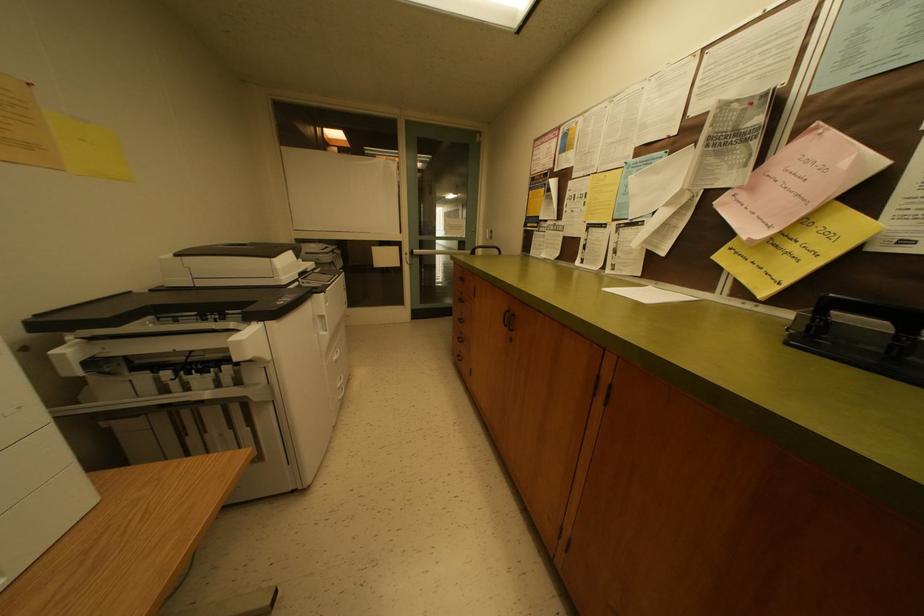
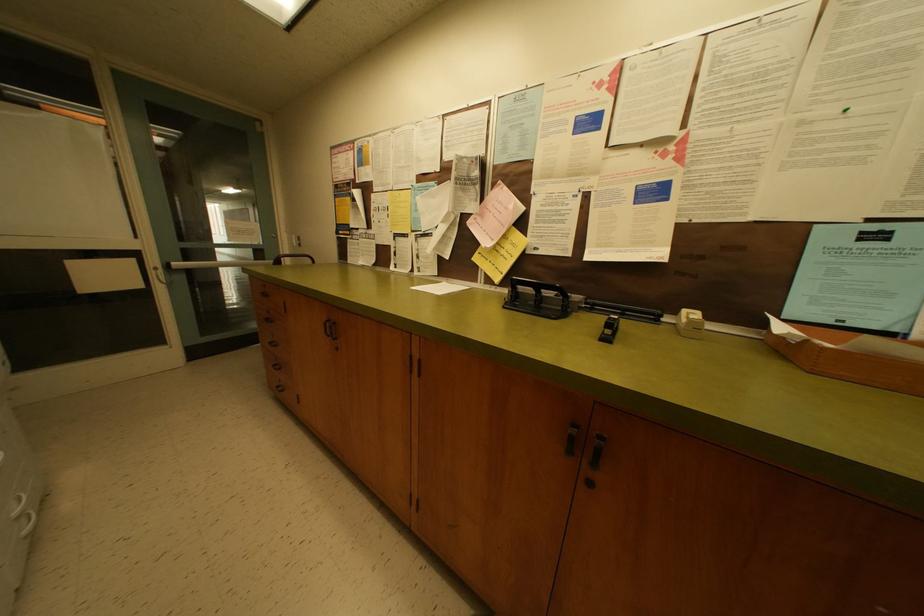
Question: The images are taken continuously from a first-person perspective. In which direction is your viewpoint rotating?

Choices:
 (A) Left
 (B) Right
 (C) Up
 (D) Down

Answer: (B)